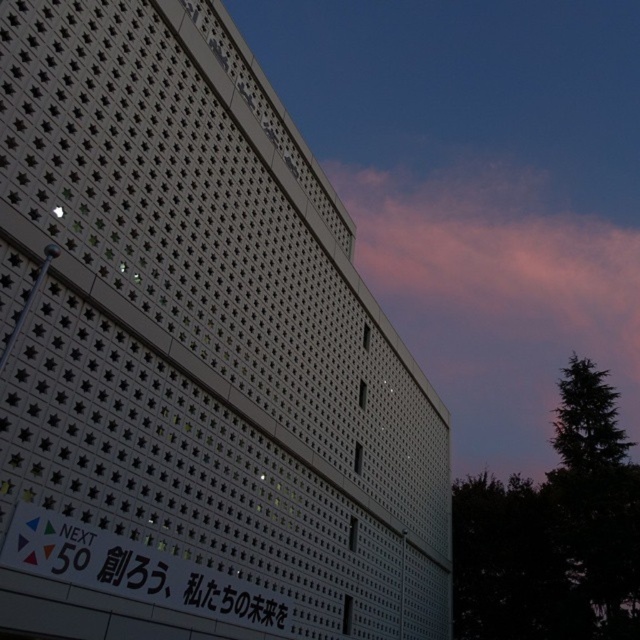
Can you confirm if dark green leafy tree at upper right is shorter than white glossy sign at lower left?

No, dark green leafy tree at upper right is not shorter than white glossy sign at lower left.

Is point (561, 422) positioned in front of point (269, 595)?

No, (561, 422) is behind (269, 595).

This screenshot has width=640, height=640. Identify the location of dark green leafy tree at upper right. (554, 531).

Which is behind, point (385, 228) or point (131, 577)?

Point (385, 228)

In the scene shown: Measure the distance between point [468,276] and camera.

The distance of point [468,276] from camera is 200.17 meters.

Which is in front, point (500, 208) or point (138, 541)?

Point (138, 541)

This screenshot has width=640, height=640. Identify the location of pink cotton cloud at upper center. (497, 296).

Is pink cotton cloud at upper center shorter than dark green leafy tree at upper right?

Incorrect, pink cotton cloud at upper center's height does not fall short of dark green leafy tree at upper right's.

Can you confirm if pink cotton cloud at upper center is positioned below dark green leafy tree at upper right?

No, pink cotton cloud at upper center is not below dark green leafy tree at upper right.

Is point (538, 454) positioned before point (554, 632)?

No.

Find the location of a particular element. Image resolution: width=640 pixels, height=640 pixels. pink cotton cloud at upper center is located at coordinates (497, 296).